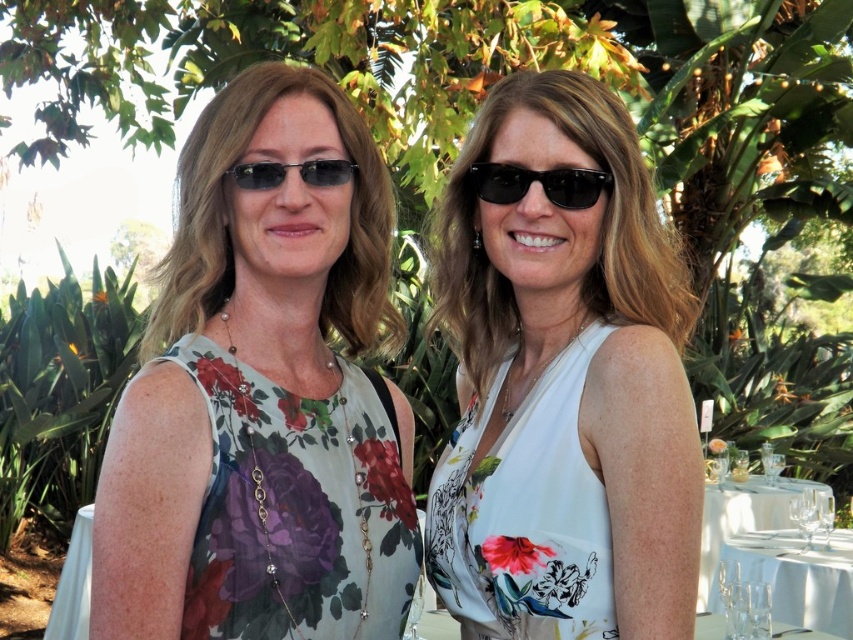
You are a photographer at the event and need to position yourself to capture both the white floral dress at center and the floral print fabric dress at left in the same frame. Based on their positions, which direction should you move to ensure both are visible?

Since the white floral dress at center is located above the floral print fabric dress at left, you should position yourself below the white floral dress at center to include both in the frame.

You are at the center of the image and want to move towards the white floral dress at center. Which direction should you go?

The white floral dress at center is already at the center of the image, so you don not need to move in any direction to reach it.